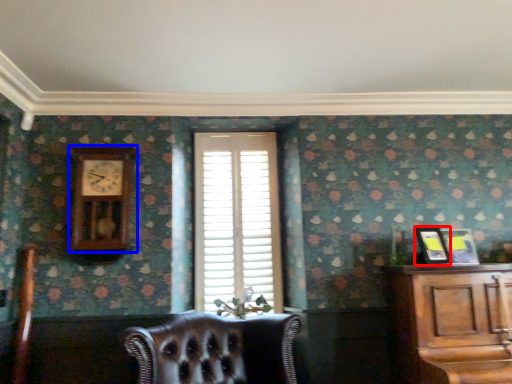
Question: Which of the following is the farthest to the observer, picture frame (highlighted by a red box) or clock (highlighted by a blue box)?

Choices:
 (A) picture frame
 (B) clock

Answer: (B)